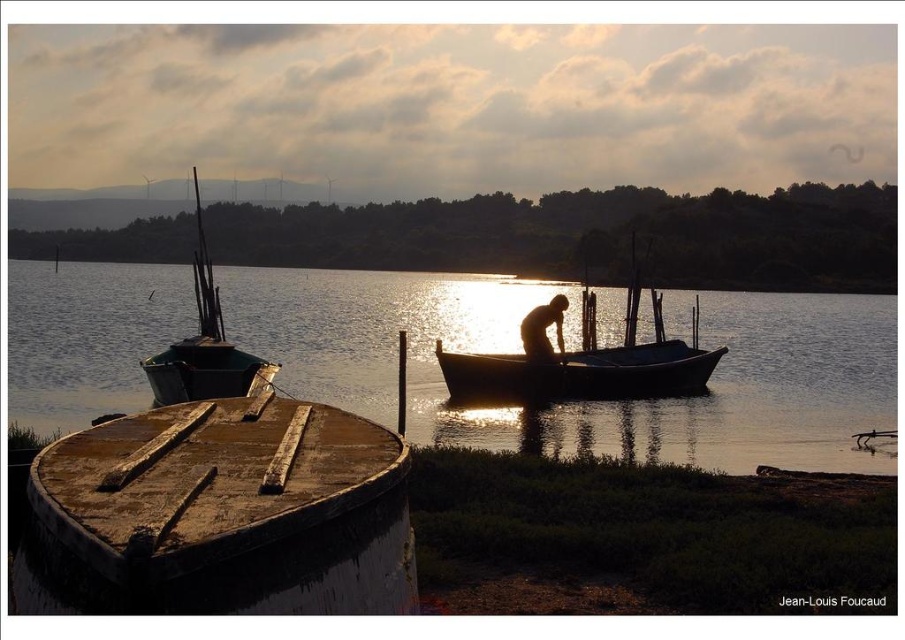
Is wooden boat at center smaller than smooth wooden canoe at center?

No, wooden boat at center is not smaller than smooth wooden canoe at center.

Does wooden boat at center have a greater height compared to smooth wooden canoe at center?

Yes.

The width and height of the screenshot is (905, 640). What are the coordinates of `wooden boat at center` in the screenshot? It's located at (586, 355).

Identify the location of wooden boat at center. This screenshot has height=640, width=905. (586, 355).

Is wooden boat at center positioned behind green wooden boat at left?

Yes, it is.

Is point (499, 388) closer to viewer compared to point (160, 369)?

No, (499, 388) is further to viewer.

What do you see at coordinates (586, 355) in the screenshot? Image resolution: width=905 pixels, height=640 pixels. I see `wooden boat at center` at bounding box center [586, 355].

The height and width of the screenshot is (640, 905). I want to click on wooden boat at center, so click(x=586, y=355).

Is smooth water at boat right to the right of smooth wooden canoe at center from the viewer's perspective?

Incorrect, smooth water at boat right is not on the right side of smooth wooden canoe at center.

Between smooth water at boat right and smooth wooden canoe at center, which one has more height?

smooth water at boat right

Describe the element at coordinates (573, 348) in the screenshot. I see `smooth water at boat right` at that location.

You are a GUI agent. You are given a task and a screenshot of the screen. Output one action in this format:
    pyautogui.click(x=<x>, y=<y>)
    Task: Click on the smooth water at boat right
    
    Given the screenshot: What is the action you would take?
    pyautogui.click(x=573, y=348)